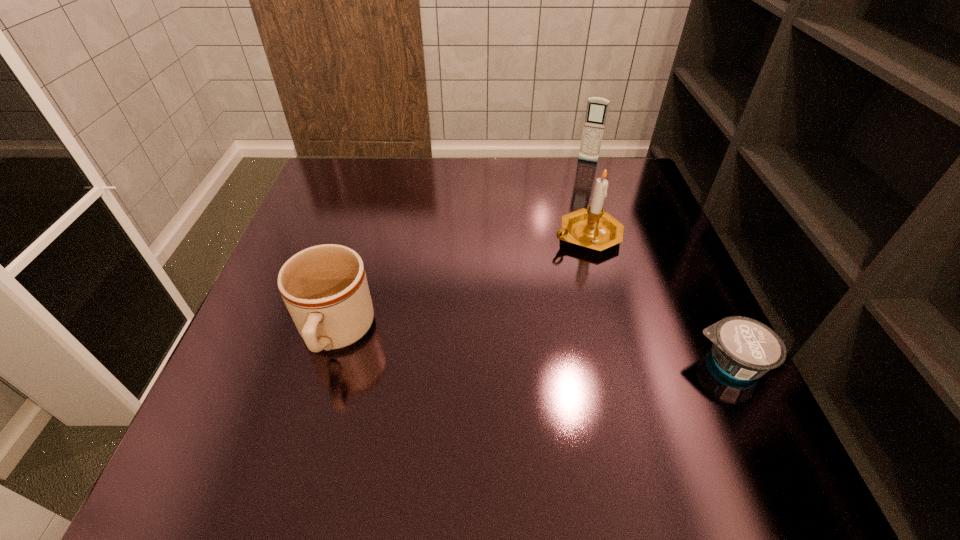
Where is `the leftmost object`? the leftmost object is located at coordinates (325, 289).

Identify the location of mug. (325, 289).

Identify the location of the shortest object. (743, 348).

Where is `the rightmost object`? This screenshot has height=540, width=960. the rightmost object is located at coordinates (743, 348).

Image resolution: width=960 pixels, height=540 pixels. In order to click on the second farthest object in this screenshot , I will do `click(593, 228)`.

Where is `cellular telephone`? This screenshot has height=540, width=960. cellular telephone is located at coordinates (597, 108).

Image resolution: width=960 pixels, height=540 pixels. Find the location of `vacant space situated 0.050m on the side of the leftmost object with the handle`. vacant space situated 0.050m on the side of the leftmost object with the handle is located at coordinates (316, 403).

Find the location of a particular element. The height and width of the screenshot is (540, 960). vacant space located 0.130m on the left of the rightmost object is located at coordinates (624, 363).

What are the coordinates of `vacant area situated 0.130m with a handle on the second farthest object` in the screenshot? It's located at (539, 285).

You are a GUI agent. You are given a task and a screenshot of the screen. Output one action in this format:
    pyautogui.click(x=<x>, y=<y>)
    Task: Click on the blank space located with a handle on the second farthest object
    The width and height of the screenshot is (960, 540).
    Given the screenshot: What is the action you would take?
    pyautogui.click(x=491, y=333)